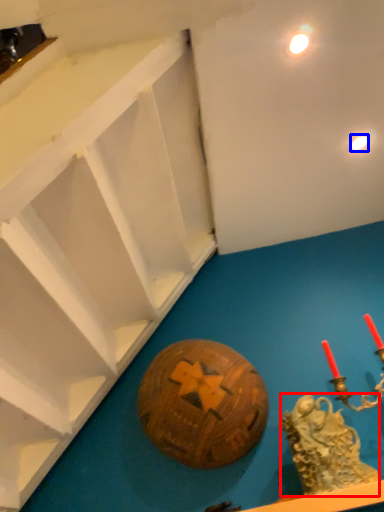
Question: Which object is further to the camera taking this photo, type (highlighted by a red box) or light (highlighted by a blue box)?

Choices:
 (A) type
 (B) light

Answer: (B)